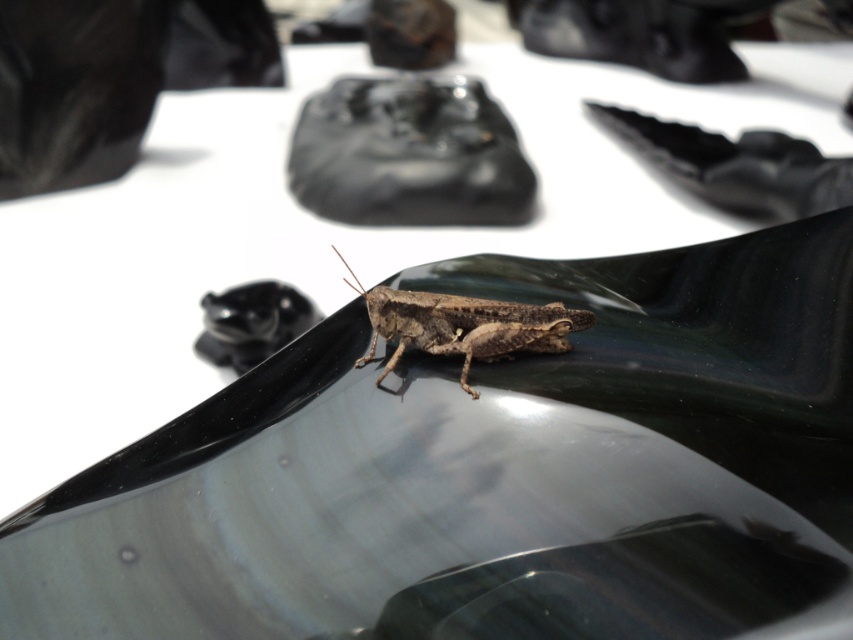
Between black glossy shoe at upper center and brown matte grasshopper at center, which one has less height?

With less height is brown matte grasshopper at center.

How far apart are black glossy shoe at upper center and brown matte grasshopper at center?

The distance of black glossy shoe at upper center from brown matte grasshopper at center is 28.13 inches.

Describe the element at coordinates (735, 164) in the screenshot. Image resolution: width=853 pixels, height=640 pixels. I see `black glossy shoe at upper center` at that location.

In order to click on black glossy shoe at upper center in this screenshot , I will do `click(735, 164)`.